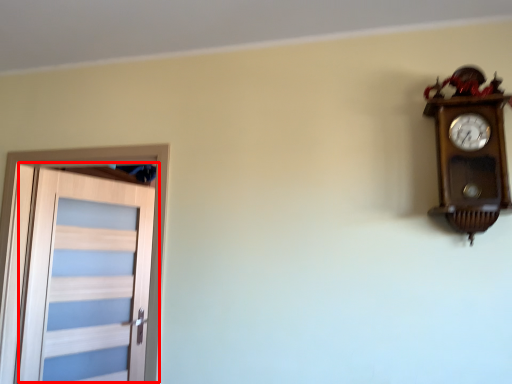
Question: In this image, where is door (annotated by the red box) located relative to wall clock?

Choices:
 (A) right
 (B) left

Answer: (B)